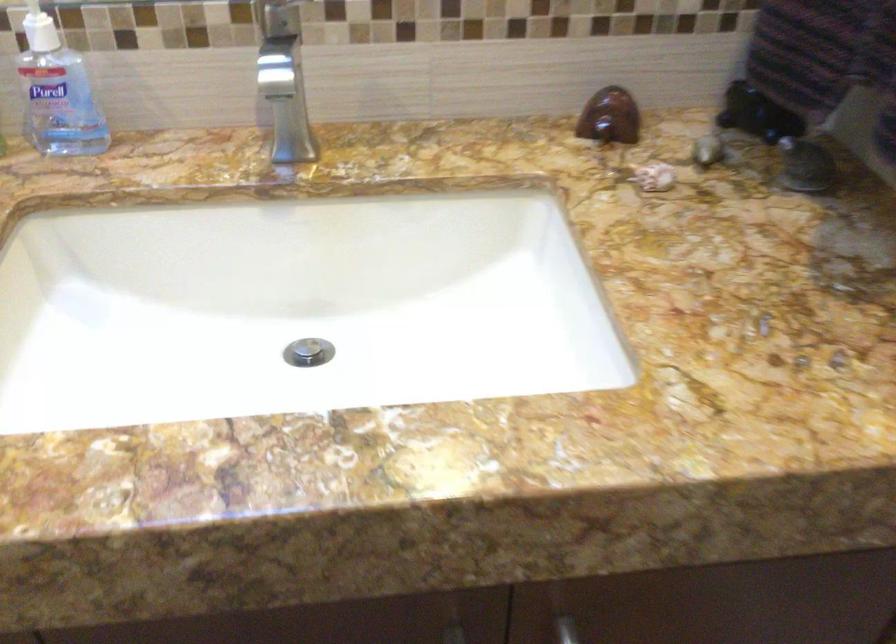
At what (x,y) coordinates should I click in order to perform the action: click on soap dispenser pump. Please return your answer as a coordinate pair (x, y). Looking at the image, I should click on (40, 33).